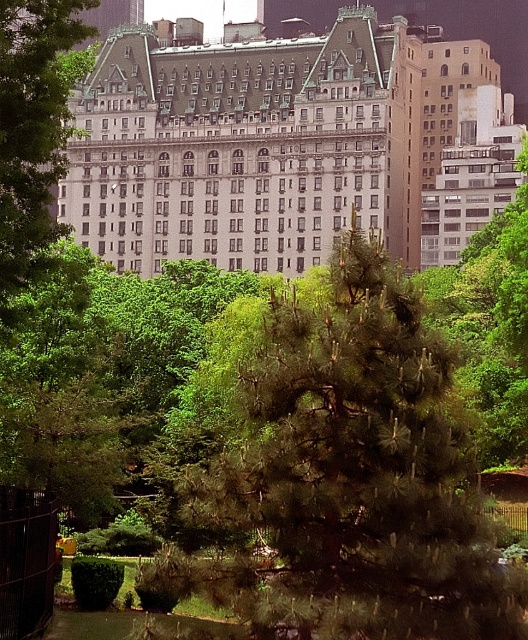
Question: Which point appears farthest from the camera in this image?

Choices:
 (A) (324, 544)
 (B) (4, 182)

Answer: (B)

Question: Which point appears closest to the camera in this image?

Choices:
 (A) (39, 214)
 (B) (211, 499)
 (C) (163, 184)

Answer: (B)

Question: Can you confirm if dark green pine tree at center is positioned to the left of white stone building at center?

Choices:
 (A) yes
 (B) no

Answer: (B)

Question: Is white stone building at center smaller than green leafy tree at center?

Choices:
 (A) yes
 (B) no

Answer: (B)

Question: Which point is closer to the camera taking this photo?

Choices:
 (A) (14, 136)
 (B) (147, 214)

Answer: (A)

Question: Observing the image, what is the correct spatial positioning of dark green pine tree at center in reference to green leafy tree at center?

Choices:
 (A) right
 (B) left

Answer: (A)